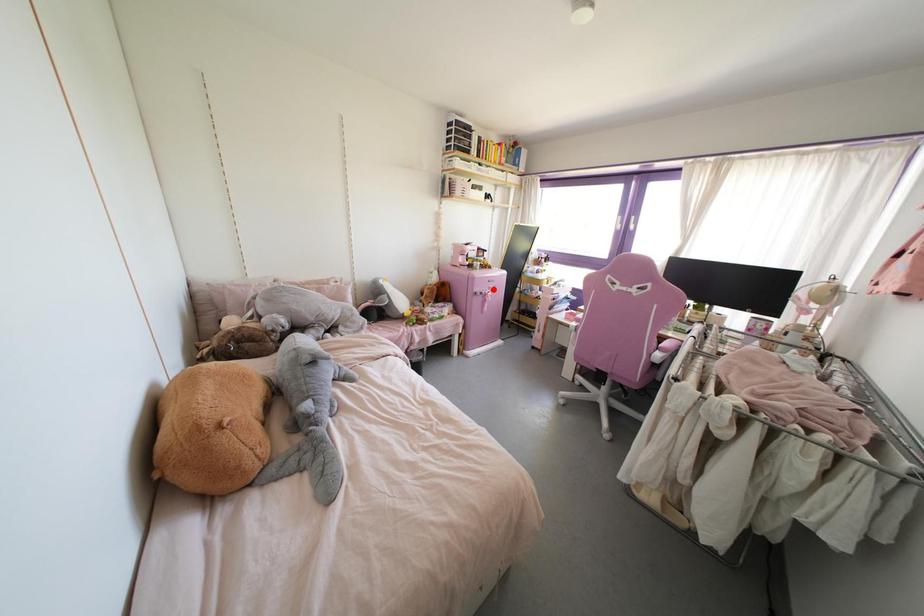
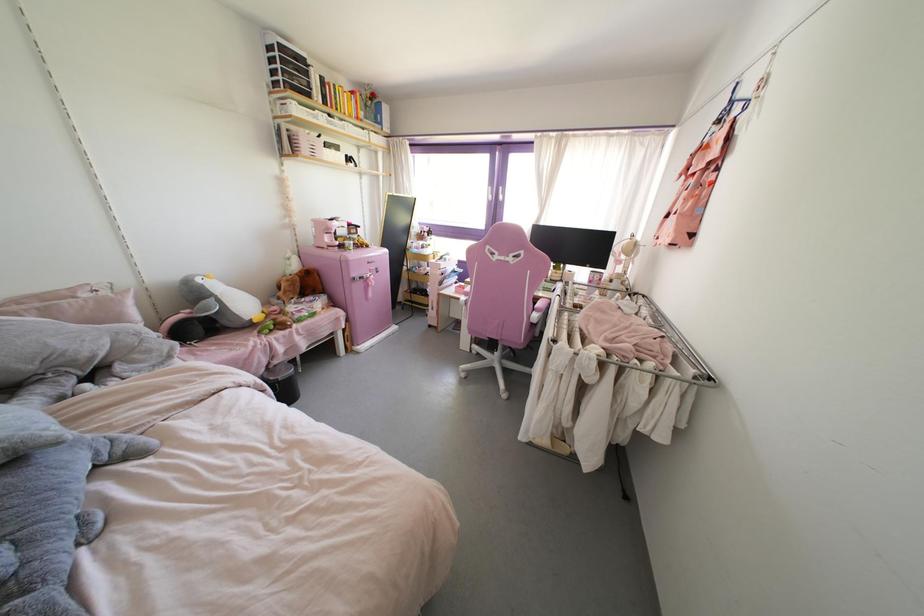
Where in the second image is the point corresponding to the highlighted location from the first image?

(377, 272)